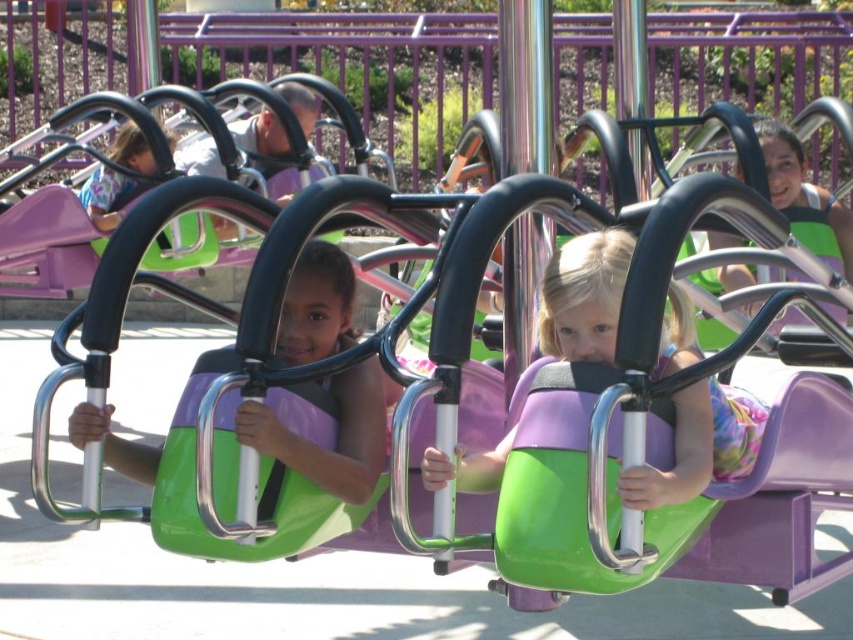
Question: Can you confirm if matte purple helmet at center is positioned below matte green helmet at center?

Choices:
 (A) yes
 (B) no

Answer: (A)

Question: Which of these objects is positioned closest to the matte green seat at center?

Choices:
 (A) matte green helmet at center
 (B) matte purple helmet at center

Answer: (B)

Question: Estimate the real-world distances between objects in this image. Which object is closer to the matte green seat at center?

Choices:
 (A) matte purple helmet at center
 (B) matte green helmet at center

Answer: (A)

Question: Does matte purple helmet at center appear under matte green helmet at center?

Choices:
 (A) no
 (B) yes

Answer: (B)

Question: Which object is positioned farthest from the matte green seat at center?

Choices:
 (A) matte green helmet at center
 (B) matte purple helmet at center

Answer: (A)

Question: Does matte purple helmet at center have a greater width compared to matte green helmet at center?

Choices:
 (A) no
 (B) yes

Answer: (A)